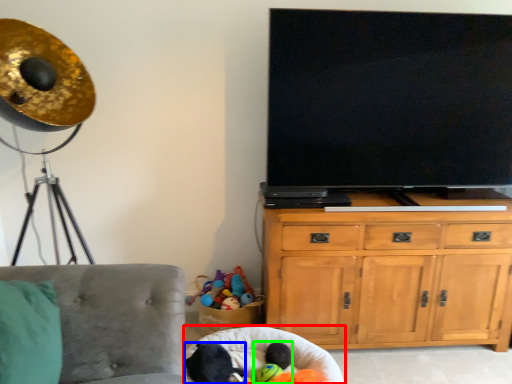
Question: Which is farther away from bean bag chair (highlighted by a red box)? animal (highlighted by a blue box) or toy (highlighted by a green box)?

Choices:
 (A) animal
 (B) toy

Answer: (A)